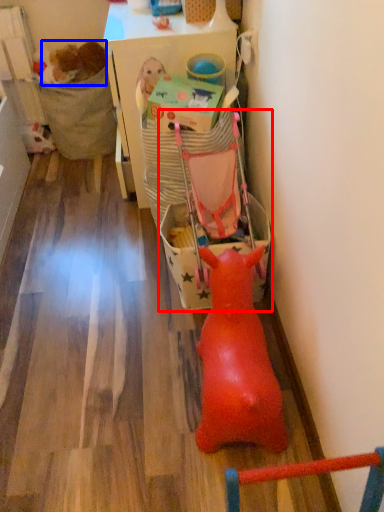
Question: Among these objects, which one is farthest to the camera, baby carriage (highlighted by a red box) or animal (highlighted by a blue box)?

Choices:
 (A) baby carriage
 (B) animal

Answer: (B)